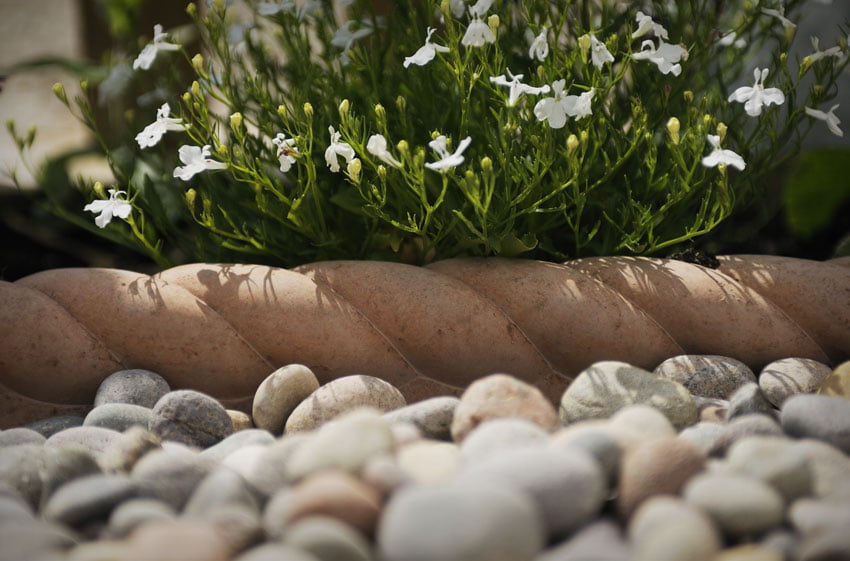
The image size is (850, 561). In order to click on segments in decrative boarder in this screenshot , I will do (x=3, y=401), (x=37, y=337), (x=146, y=316), (x=299, y=305), (x=406, y=300), (x=554, y=300), (x=681, y=295), (x=791, y=275).